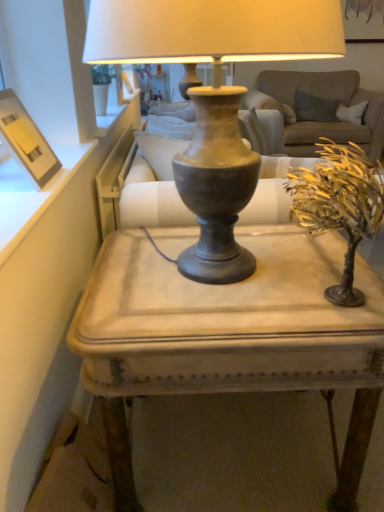
Image resolution: width=384 pixels, height=512 pixels. In order to click on matte wood picture frame at upper left in this screenshot , I will do `click(25, 141)`.

At what (x,y) coordinates should I click in order to perform the action: click on matte gray table at center. Please return your answer as a coordinate pair (x, y). Looking at the image, I should click on (228, 334).

Locate an element on the screen. This screenshot has height=512, width=384. gold textured tree at right is located at coordinates (340, 205).

Is matte gray vase at center in contact with matte wood picture frame at upper left?

No, matte gray vase at center is not beside matte wood picture frame at upper left.

From the image's perspective, which one is positioned higher, matte gray vase at center or matte wood picture frame at upper left?

Answer: matte wood picture frame at upper left is shown above in the image.

This screenshot has width=384, height=512. What are the coordinates of `lamp that is below the matte wood picture frame at upper left (from the image's perspective)` in the screenshot? It's located at (214, 96).

How far apart are matte gray vase at center and matte wood picture frame at upper left?

matte gray vase at center is 43.60 centimeters away from matte wood picture frame at upper left.

Who is taller, matte wood picture frame at upper left or matte gray table at center?

Standing taller between the two is matte gray table at center.

Considering the positions of point (33, 137) and point (302, 240), is point (33, 137) closer or farther from the camera than point (302, 240)?

Clearly, point (33, 137) is closer to the camera than point (302, 240).

Considering the relative positions of matte wood picture frame at upper left and matte gray table at center in the image provided, is matte wood picture frame at upper left behind matte gray table at center?

Yes, it is behind matte gray table at center.

How many degrees apart are the facing directions of matte wood picture frame at upper left and matte gray table at center?

matte wood picture frame at upper left and matte gray table at center are facing 1.17 degrees away from each other.

Would you say matte gray vase at center is to the left or to the right of matte gray table at center in the picture?

matte gray vase at center is to the left of matte gray table at center.

From a real-world perspective, is matte gray vase at center positioned under matte gray table at center based on gravity?

No, from a real-world perspective, matte gray vase at center is not below matte gray table at center.

Is matte gray vase at center facing away from matte gray table at center?

No, matte gray table at center is not at the back of matte gray vase at center.

Is point (315, 215) closer to camera compared to point (200, 22)?

No, (315, 215) is further to viewer.

Can you confirm if gold textured tree at right is bigger than matte gray vase at center?

No, gold textured tree at right is not bigger than matte gray vase at center.

Locate an element on the screen. The image size is (384, 512). houseplant below the matte gray vase at center (from a real-world perspective) is located at coordinates tap(340, 205).

Would you consider matte gray table at center to be distant from matte gray vase at center?

matte gray table at center is actually quite close to matte gray vase at center.

Is matte gray vase at center at the back of matte gray table at center?

No, matte gray vase at center is not at the back of matte gray table at center.

From a real-world perspective, who is located lower, matte gray table at center or matte gray vase at center?

matte gray table at center, from a real-world perspective.

Can you tell me how much matte gray table at center and matte gray vase at center differ in facing direction?

The facing directions of matte gray table at center and matte gray vase at center are 0.000314 degrees apart.

From a real-world perspective, is matte gray vase at center positioned above or below gold textured tree at right?

Clearly, from a real-world perspective, matte gray vase at center is above gold textured tree at right.

Is matte gray vase at center directly adjacent to gold textured tree at right?

matte gray vase at center and gold textured tree at right are clearly separated.

Does matte gray vase at center have a larger size compared to gold textured tree at right?

Indeed, matte gray vase at center has a larger size compared to gold textured tree at right.

What's the angular difference between matte gray vase at center and gold textured tree at right's facing directions?

0.00118 degrees.

Based on the photo, is matte wood picture frame at upper left not within gold textured tree at right?

Yes, matte wood picture frame at upper left is located beyond the bounds of gold textured tree at right.

From the picture: Who is taller, matte wood picture frame at upper left or gold textured tree at right?

Standing taller between the two is gold textured tree at right.

Are matte wood picture frame at upper left and gold textured tree at right beside each other?

No, matte wood picture frame at upper left is not touching gold textured tree at right.

Measure the distance from matte wood picture frame at upper left to gold textured tree at right.

They are 27.14 inches apart.

Identify the location of lamp on the right of matte wood picture frame at upper left. The width and height of the screenshot is (384, 512). (214, 96).

You are a GUI agent. You are given a task and a screenshot of the screen. Output one action in this format:
    pyautogui.click(x=<x>, y=<y>)
    Task: Click on the picture frame that is above the matte gray table at center (from the image's perspective)
    This screenshot has height=512, width=384.
    Given the screenshot: What is the action you would take?
    pyautogui.click(x=25, y=141)

Looking at the image, which one is located closer to matte wood picture frame at upper left, gold textured tree at right or matte gray table at center?

Based on the image, matte gray table at center appears to be nearer to matte wood picture frame at upper left.

Estimate the real-world distances between objects in this image. Which object is further from matte gray vase at center, gold textured tree at right or matte gray table at center?

matte gray table at center lies further to matte gray vase at center than the other object.

When comparing their distances from matte wood picture frame at upper left, does matte gray vase at center or gold textured tree at right seem further?

Among the two, gold textured tree at right is located further to matte wood picture frame at upper left.

Which object lies further to the anchor point matte gray table at center, gold textured tree at right or matte wood picture frame at upper left?

The object further to matte gray table at center is matte wood picture frame at upper left.

When comparing their distances from matte gray vase at center, does matte gray table at center or matte wood picture frame at upper left seem further?

The object further to matte gray vase at center is matte wood picture frame at upper left.

Estimate the real-world distances between objects in this image. Which object is further from matte wood picture frame at upper left, matte gray vase at center or matte gray table at center?

Among the two, matte gray table at center is located further to matte wood picture frame at upper left.

Considering their positions, is gold textured tree at right positioned further to matte wood picture frame at upper left than matte gray vase at center?

gold textured tree at right.

From the image, which object appears to be nearer to matte gray table at center, matte wood picture frame at upper left or matte gray vase at center?

The object closer to matte gray table at center is matte gray vase at center.

The image size is (384, 512). What are the coordinates of `houseplant between matte gray vase at center and matte gray table at center from top to bottom` in the screenshot? It's located at (340, 205).

I want to click on table located between matte wood picture frame at upper left and gold textured tree at right in the left-right direction, so 228,334.

This screenshot has height=512, width=384. Find the location of `lamp between matte wood picture frame at upper left and matte gray table at center vertically`. lamp between matte wood picture frame at upper left and matte gray table at center vertically is located at coordinates (214, 96).

Image resolution: width=384 pixels, height=512 pixels. In order to click on lamp between matte wood picture frame at upper left and gold textured tree at right in this screenshot , I will do `click(214, 96)`.